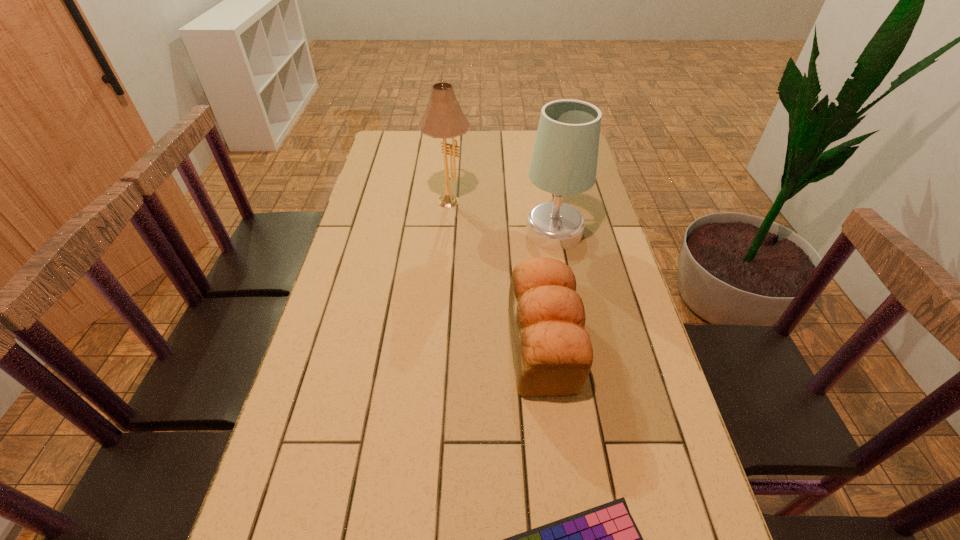
The image size is (960, 540). What are the coordinates of `free location located 0.180m on the right of the third farthest object` in the screenshot? It's located at (649, 346).

Where is `object at the right edge`? This screenshot has height=540, width=960. object at the right edge is located at coordinates (564, 162).

The width and height of the screenshot is (960, 540). In order to click on vacant area at the far edge in this screenshot , I will do `click(505, 145)`.

The width and height of the screenshot is (960, 540). Find the location of `blank space at the left edge`. blank space at the left edge is located at coordinates (323, 403).

The image size is (960, 540). In the image, there is a desktop. Find the location of `vacant space at the right edge`. vacant space at the right edge is located at coordinates (605, 343).

Locate an element on the screen. vacant space at the far left corner of the desktop is located at coordinates click(380, 156).

Identify the location of vacant space in between the second farthest object and the left lampshade. (501, 215).

You are a GUI agent. You are given a task and a screenshot of the screen. Output one action in this format:
    pyautogui.click(x=<x>, y=<y>)
    Task: Click on the vacant space in between the left lampshade and the third nearest object
    The height and width of the screenshot is (540, 960).
    Given the screenshot: What is the action you would take?
    pyautogui.click(x=501, y=215)

This screenshot has width=960, height=540. Identify the location of vacant area that lies between the nearer lampshade and the farther lampshade. (501, 215).

Where is `vacant space that is in between the left lampshade and the third farthest object`? The width and height of the screenshot is (960, 540). vacant space that is in between the left lampshade and the third farthest object is located at coordinates (496, 272).